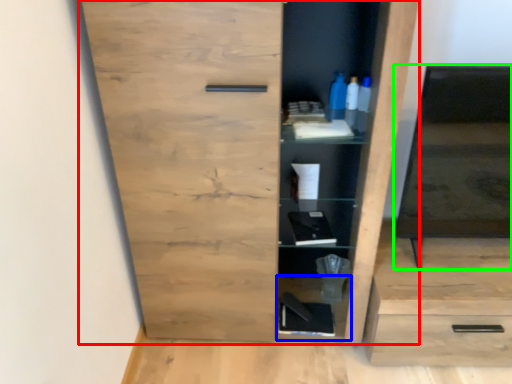
Question: Estimate the real-world distances between objects in this image. Which object is farther from cupboard (highlighted by a red box), cabinet (highlighted by a blue box) or medicine cabinet (highlighted by a green box)?

Choices:
 (A) cabinet
 (B) medicine cabinet

Answer: (A)